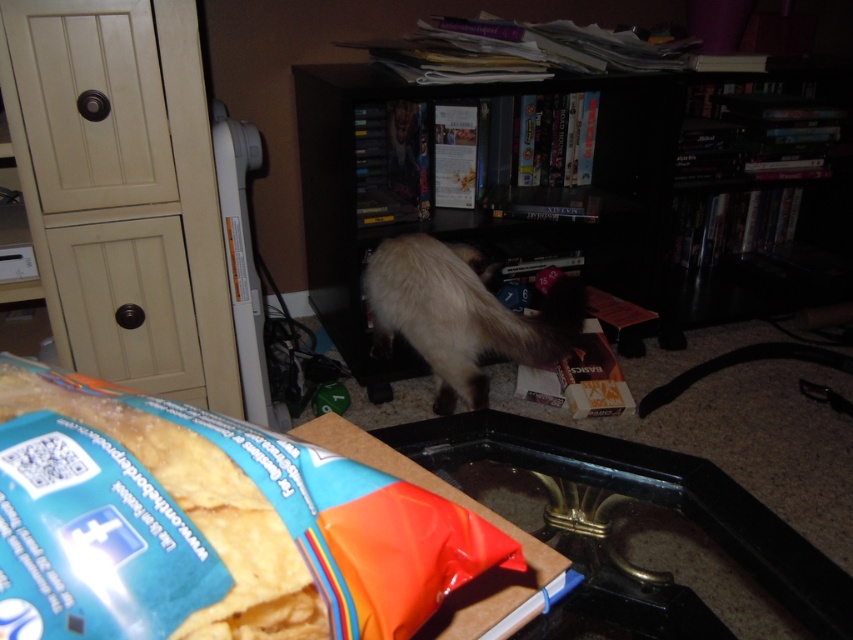
You are organizing the items on your desk. You need to place the translucent plastic bag of chips at lower center somewhere. Where is the black matte bookcase at center in relation to it?

The translucent plastic bag of chips at lower center is located below the black matte bookcase at center, so the black matte bookcase at center is above it.

You are a robotic vacuum cleaner with a width of 1.5 feet. You are currently positioned near the translucent plastic bag of chips at lower center and want to reach the fuzzy brown cat at center to clean around it. Can you navigate the space between them without getting stuck?

The distance between the translucent plastic bag of chips at lower center and the fuzzy brown cat at center is 3.87 feet. Since the robotic vacuum cleaner is 1.5 feet wide, it has enough space to navigate between them as the distance is greater than its width.